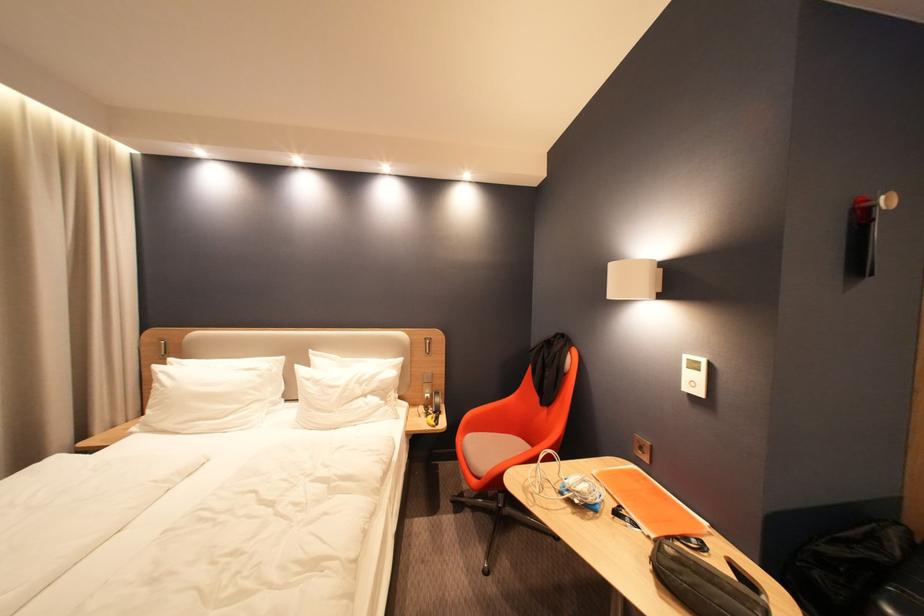
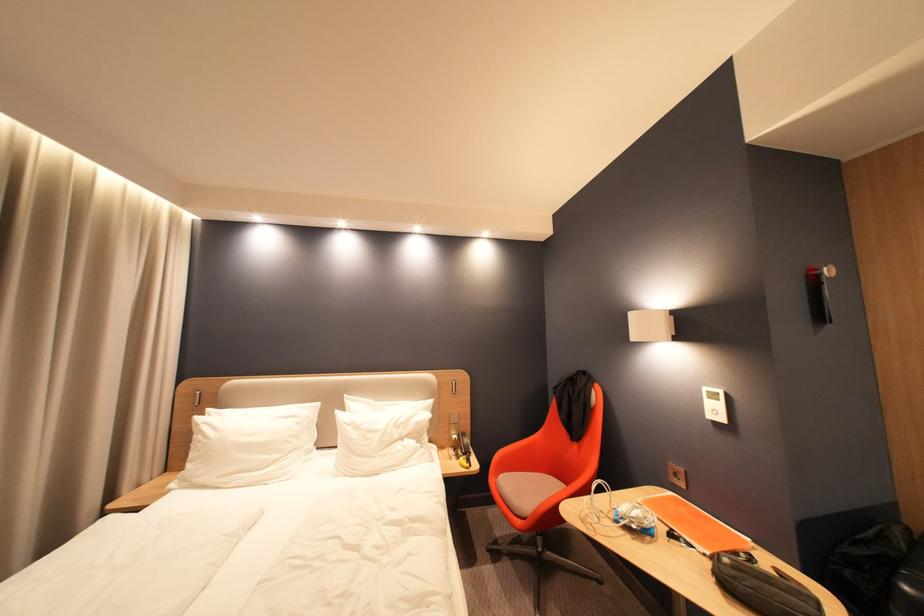
In the second image, find the point that corresponds to the point at 703,384 in the first image.

(724, 413)